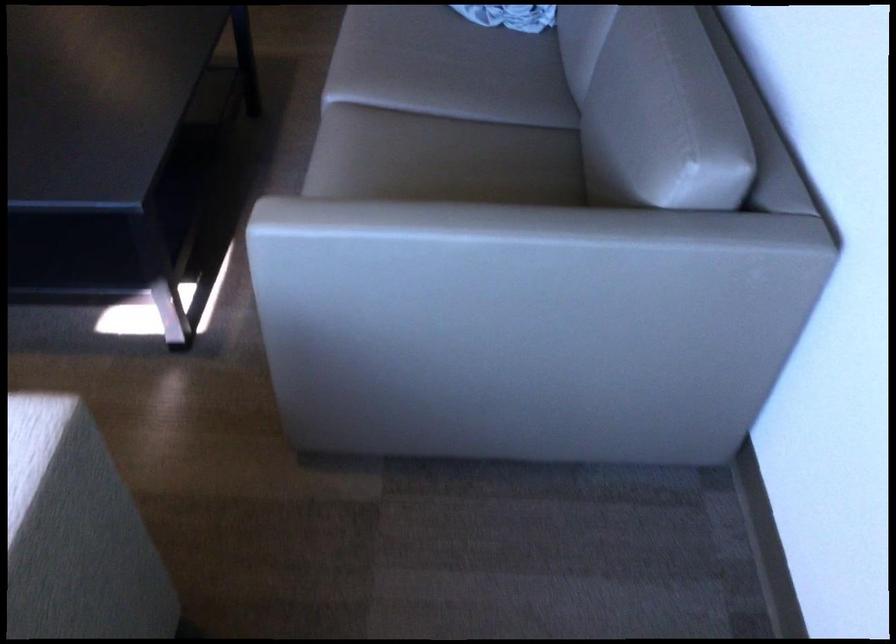
Where would you resting arm the sofa armrest? Please return your answer as a coordinate pair (x, y).

(485, 249)